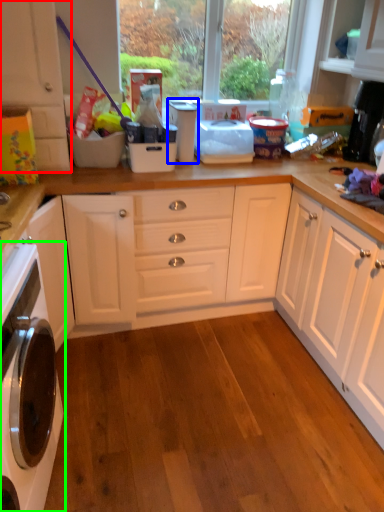
Question: Which is nearer to the cabinetry (highlighted by a red box)? appliance (highlighted by a blue box) or home appliance (highlighted by a green box).

Choices:
 (A) appliance
 (B) home appliance

Answer: (A)